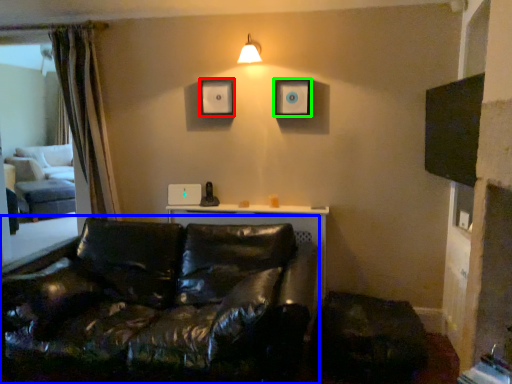
Question: Which is nearer to the picture frame (highlighted by a red box)? studio couch (highlighted by a blue box) or picture frame (highlighted by a green box).

Choices:
 (A) studio couch
 (B) picture frame

Answer: (B)